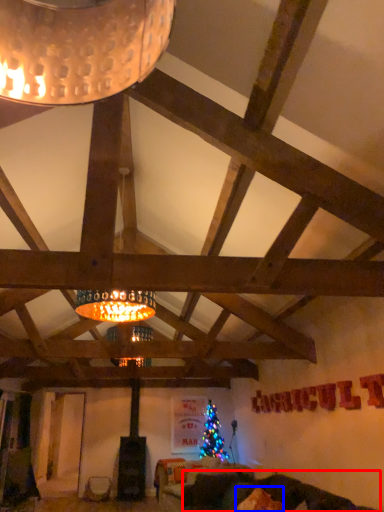
Question: Among these objects, which one is nearest to the camera, couch (highlighted by a red box) or pillow (highlighted by a blue box)?

Choices:
 (A) couch
 (B) pillow

Answer: (A)